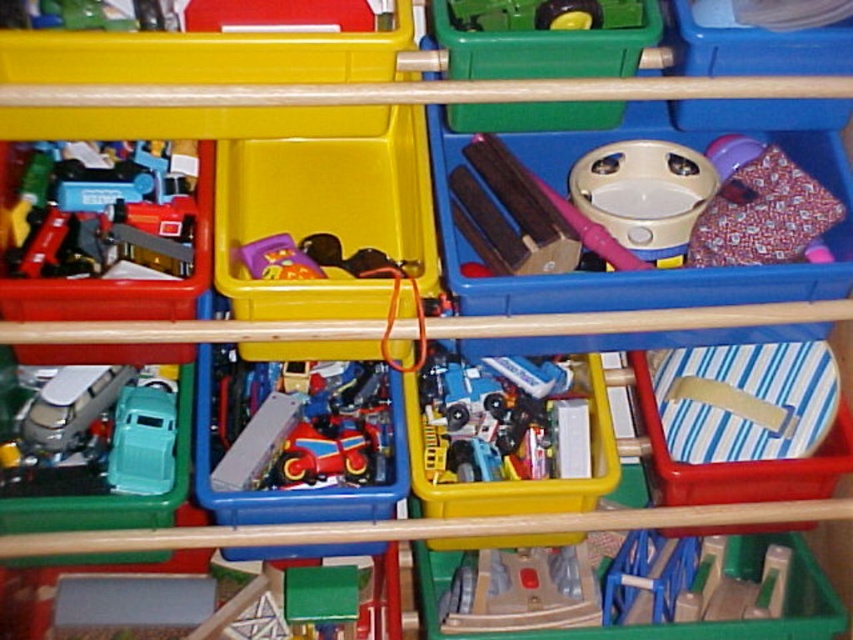
Question: Which of the following is the closest to the observer?

Choices:
 (A) matte plastic toy car at left
 (B) metallic red car at center
 (C) matte silver van at left

Answer: (A)

Question: Can you confirm if red fabric bag at upper right is thinner than rubberized plastic toy car at center?

Choices:
 (A) yes
 (B) no

Answer: (B)

Question: Estimate the real-world distances between objects in this image. Which object is farther from the shiny blue car at center?

Choices:
 (A) red fabric bag at upper right
 (B) rubberized plastic toy car at center
 (C) metallic red car at center
 (D) matte plastic toy car at left

Answer: (D)

Question: Which object is farther from the camera taking this photo?

Choices:
 (A) red fabric bag at upper right
 (B) shiny blue car at center

Answer: (B)

Question: Does matte plastic toy car at left have a greater width compared to matte silver van at left?

Choices:
 (A) no
 (B) yes

Answer: (B)

Question: Can you confirm if metallic red car at center is positioned to the right of rubberized plastic toy car at center?

Choices:
 (A) no
 (B) yes

Answer: (B)